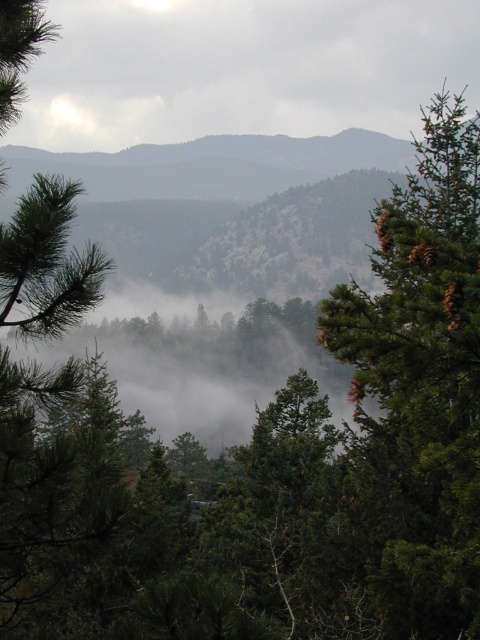
Is white fluffy cloud at upper center wider than green needle-like tree at left?

Yes.

Describe the element at coordinates (241, 68) in the screenshot. This screenshot has width=480, height=640. I see `white fluffy cloud at upper center` at that location.

The image size is (480, 640). Find the location of `white fluffy cloud at upper center`. white fluffy cloud at upper center is located at coordinates (241, 68).

Who is taller, white fluffy cloud at upper center or green needle-like at right?

With more height is white fluffy cloud at upper center.

Between white fluffy cloud at upper center and green needle-like at right, which one appears on the left side from the viewer's perspective?

white fluffy cloud at upper center

What do you see at coordinates (241, 68) in the screenshot? The image size is (480, 640). I see `white fluffy cloud at upper center` at bounding box center [241, 68].

The height and width of the screenshot is (640, 480). I want to click on white fluffy cloud at upper center, so click(241, 68).

Between green needle-like at right and green needle-like tree at left, which one is positioned higher?

Positioned higher is green needle-like at right.

The width and height of the screenshot is (480, 640). What do you see at coordinates (423, 376) in the screenshot?
I see `green needle-like at right` at bounding box center [423, 376].

The image size is (480, 640). I want to click on green needle-like at right, so click(423, 376).